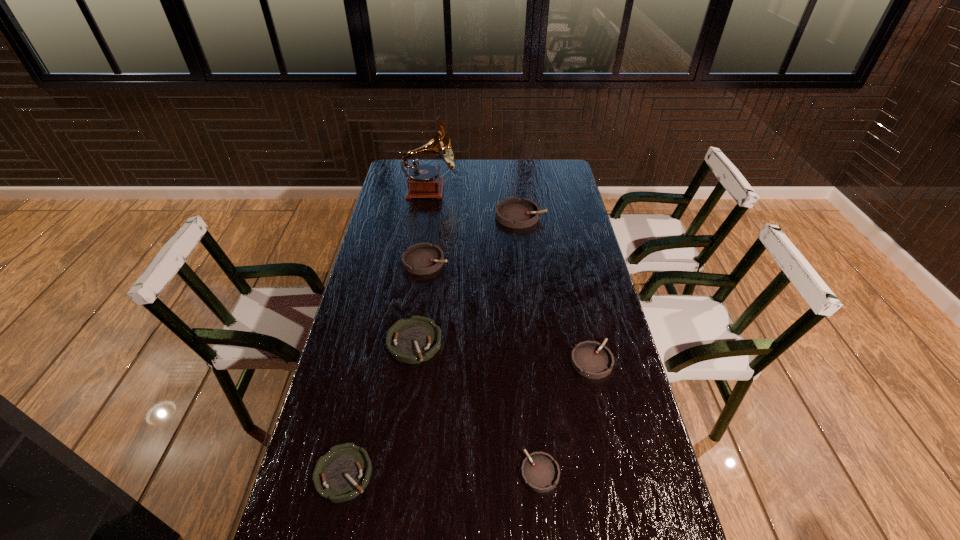
Locate an element on the screen. The width and height of the screenshot is (960, 540). the closest green ashtray relative to the third farthest gray ashtray is located at coordinates (416, 339).

Find the location of a particular element. the closest green ashtray to the smallest gray ashtray is located at coordinates (416, 339).

I want to click on vacant area in the image that satisfies the following two spatial constraints: 1. on the front side of the nearest gray ashtray; 2. on the right side of the bigger green ashtray, so click(396, 472).

At what (x,y) coordinates should I click in order to perform the action: click on free space in the image that satisfies the following two spatial constraints: 1. on the back side of the third farthest gray ashtray; 2. on the horn of the phonograph_record. Please return your answer as a coordinate pair (x, y). Image resolution: width=960 pixels, height=540 pixels. Looking at the image, I should click on (553, 190).

Image resolution: width=960 pixels, height=540 pixels. In order to click on free region that satisfies the following two spatial constraints: 1. on the front side of the second smallest gray ashtray; 2. on the left side of the fifth shortest object in this screenshot , I will do `click(412, 361)`.

The image size is (960, 540). In order to click on vacant space that satisfies the following two spatial constraints: 1. on the horn of the farther green ashtray; 2. on the left side of the tallest object in this screenshot , I will do `click(406, 342)`.

Where is `blank space that satisfies the following two spatial constraints: 1. on the back side of the farthest ashtray; 2. on the horn of the phonograph_record`? Image resolution: width=960 pixels, height=540 pixels. blank space that satisfies the following two spatial constraints: 1. on the back side of the farthest ashtray; 2. on the horn of the phonograph_record is located at coordinates (517, 190).

The image size is (960, 540). In order to click on vacant space that satisfies the following two spatial constraints: 1. on the back side of the second smallest gray ashtray; 2. on the horn of the tallest object in this screenshot , I will do `click(553, 190)`.

You are a GUI agent. You are given a task and a screenshot of the screen. Output one action in this format:
    pyautogui.click(x=<x>, y=<y>)
    Task: Click on the vacant area that satisfies the following two spatial constraints: 1. on the back side of the nearest gray ashtray; 2. on the horn of the phonograph_record
    This screenshot has width=960, height=540.
    Given the screenshot: What is the action you would take?
    pyautogui.click(x=512, y=190)